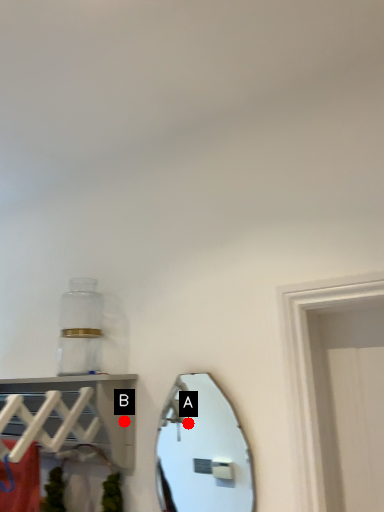
Question: Two points are circled on the image, labeled by A and B beside each circle. Which point is closer to the camera?

Choices:
 (A) A is closer
 (B) B is closer

Answer: (B)